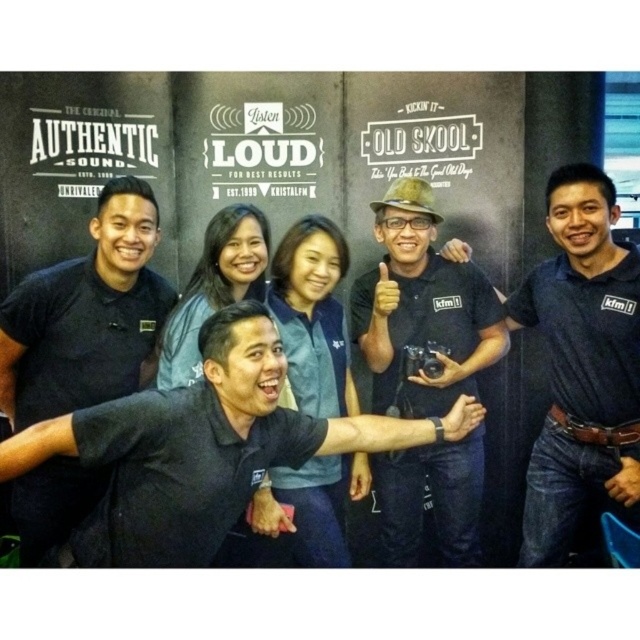
Question: Which point is farther to the camera?

Choices:
 (A) dark blue shirt at center
 (B) black matte shirt at left
 (C) black matte shirt at center
 (D) matte black shirt at center

Answer: (D)

Question: Is black matte shirt at center to the right of matte black shirt at center from the viewer's perspective?

Choices:
 (A) yes
 (B) no

Answer: (B)

Question: Observing the image, what is the correct spatial positioning of dark blue shirt at center in reference to black matte shirt at left?

Choices:
 (A) below
 (B) above

Answer: (B)

Question: From the image, what is the correct spatial relationship of dark blue shirt at center in relation to black matte shirt at left?

Choices:
 (A) left
 (B) right

Answer: (B)

Question: Among these objects, which one is farthest from the camera?

Choices:
 (A) matte black shirt at center
 (B) black matte shirt at left
 (C) black matte shirt at center

Answer: (A)

Question: Which of the following is the farthest from the observer?

Choices:
 (A) click(556, 340)
 (B) click(52, 380)

Answer: (A)